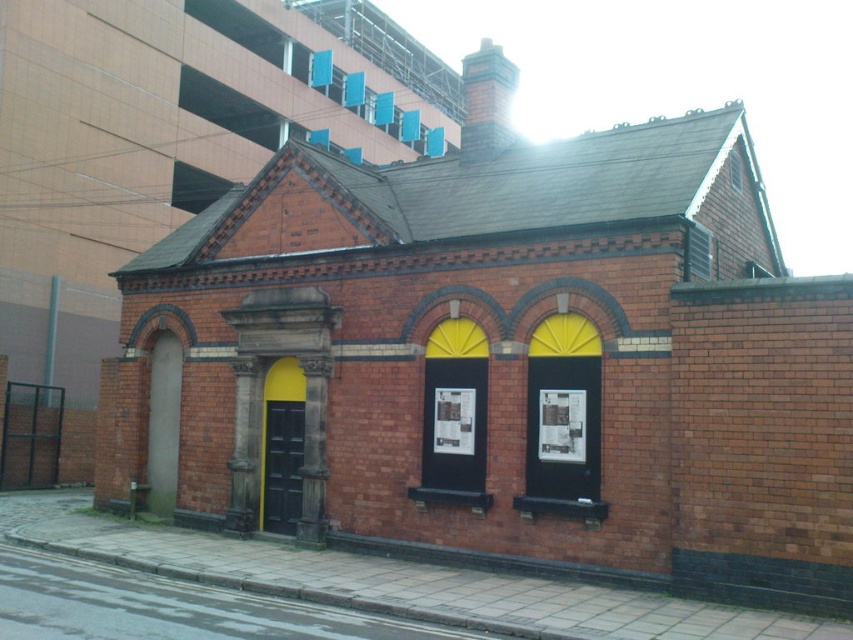
Which is more to the right, black wooden door at center or clear glass window at upper center?

Positioned to the right is clear glass window at upper center.

Is black wooden door at center positioned behind clear glass window at upper center?

That is True.

At what (x,y) coordinates should I click in order to perform the action: click on black wooden door at center. Please return your answer as a coordinate pair (x, y). Image resolution: width=853 pixels, height=640 pixels. Looking at the image, I should click on (282, 465).